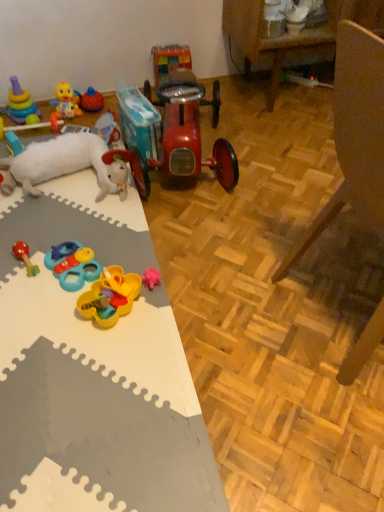
Where is `vacant area that lies between plastic/soft yellow and blue toy at lower left, the 4th toy viewed from the right, and white plush sheep at left, which appears as the 5th toy when viewed from the left`? The width and height of the screenshot is (384, 512). vacant area that lies between plastic/soft yellow and blue toy at lower left, the 4th toy viewed from the right, and white plush sheep at left, which appears as the 5th toy when viewed from the left is located at coordinates [x=77, y=226].